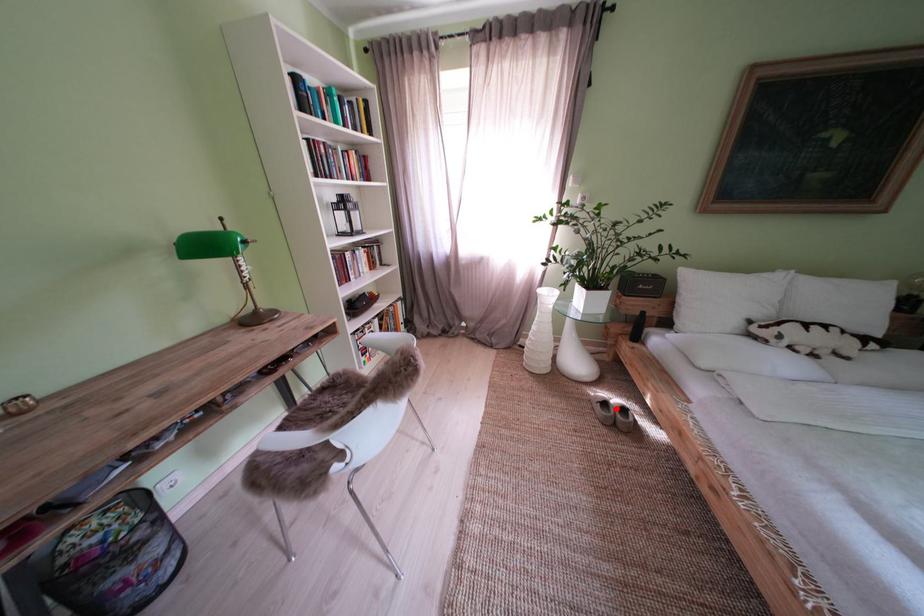
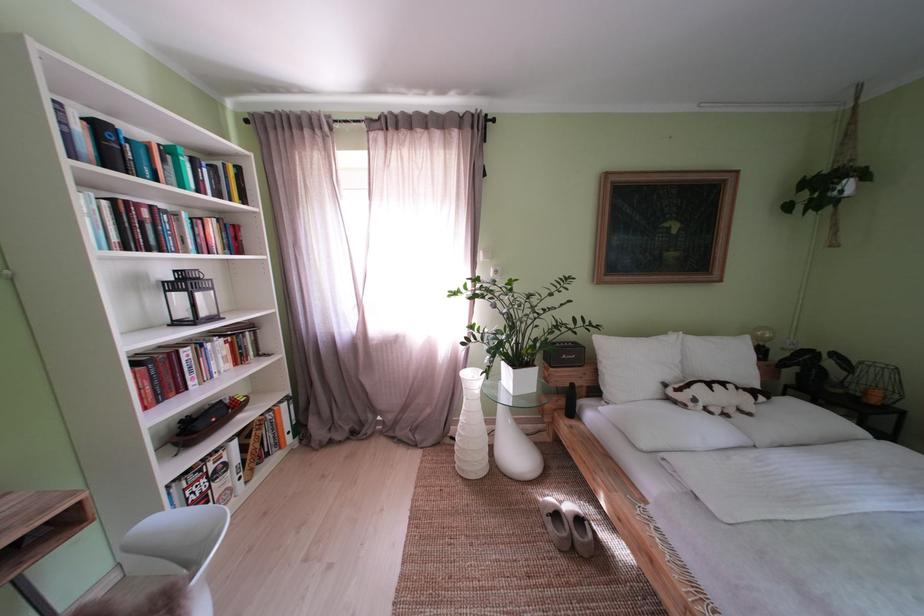
The point at the highlighted location is marked in the first image. Where is the corresponding point in the second image?

(567, 521)